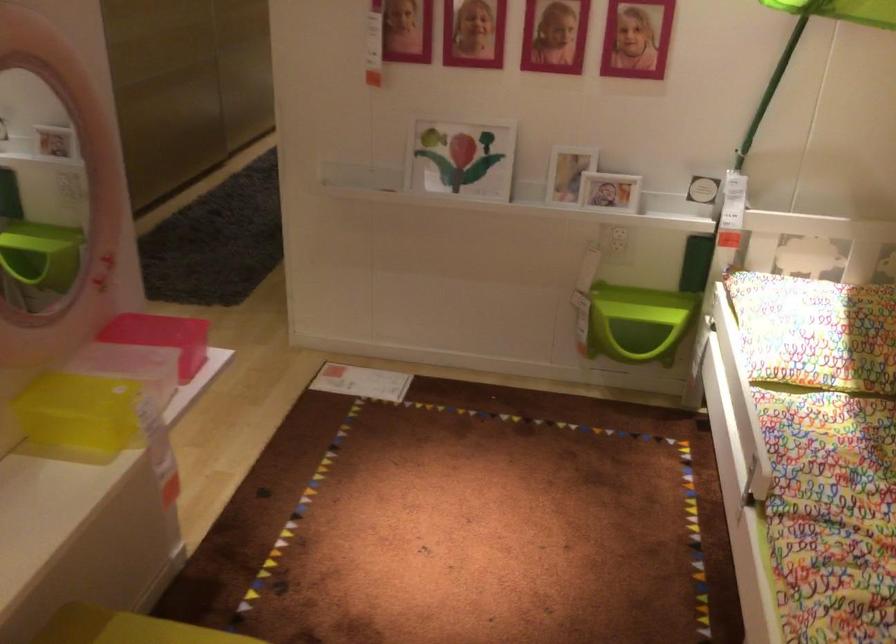
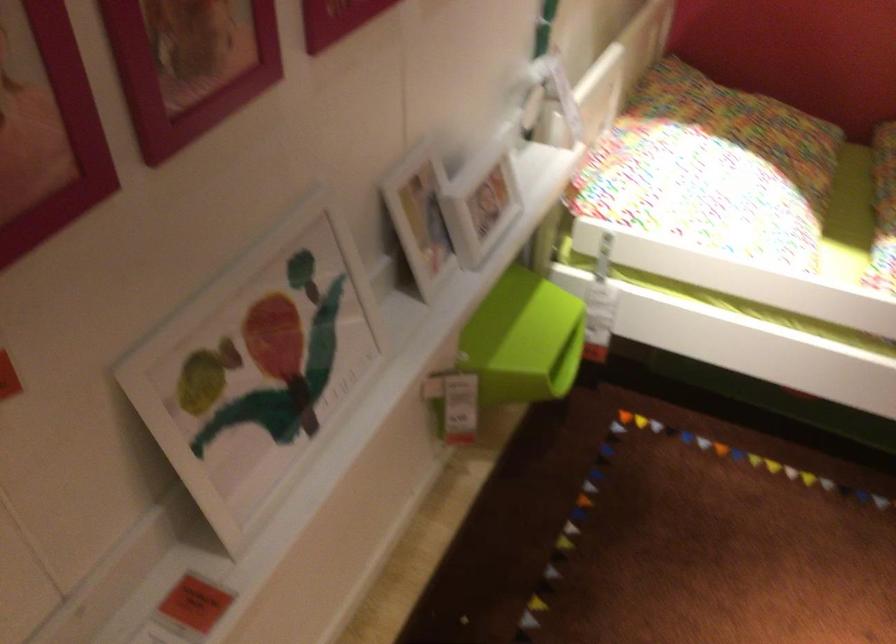
The point at (x=811, y=292) is marked in the first image. Where is the corresponding point in the second image?

(712, 169)